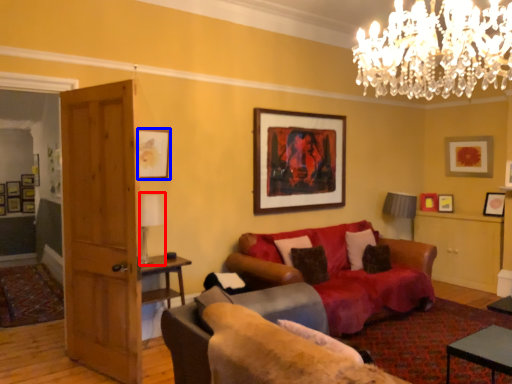
Question: Which object is further to the camera taking this photo, lamp (highlighted by a red box) or picture frame (highlighted by a blue box)?

Choices:
 (A) lamp
 (B) picture frame

Answer: (B)